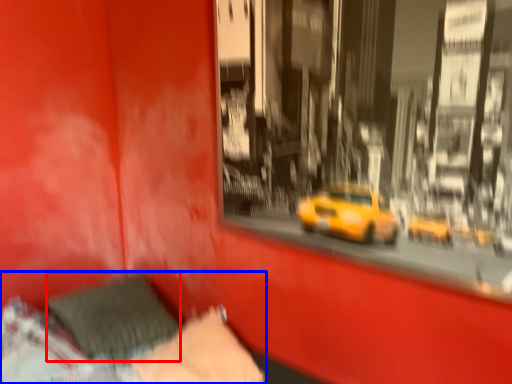
Question: Which of the following is the closest to the observer, pillow (highlighted by a red box) or bed (highlighted by a blue box)?

Choices:
 (A) pillow
 (B) bed

Answer: (B)